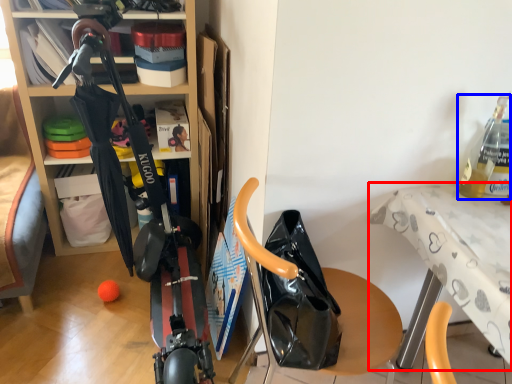
Question: Which object appears farthest to the camera in this image, table (highlighted by a red box) or bottle (highlighted by a blue box)?

Choices:
 (A) table
 (B) bottle

Answer: (B)